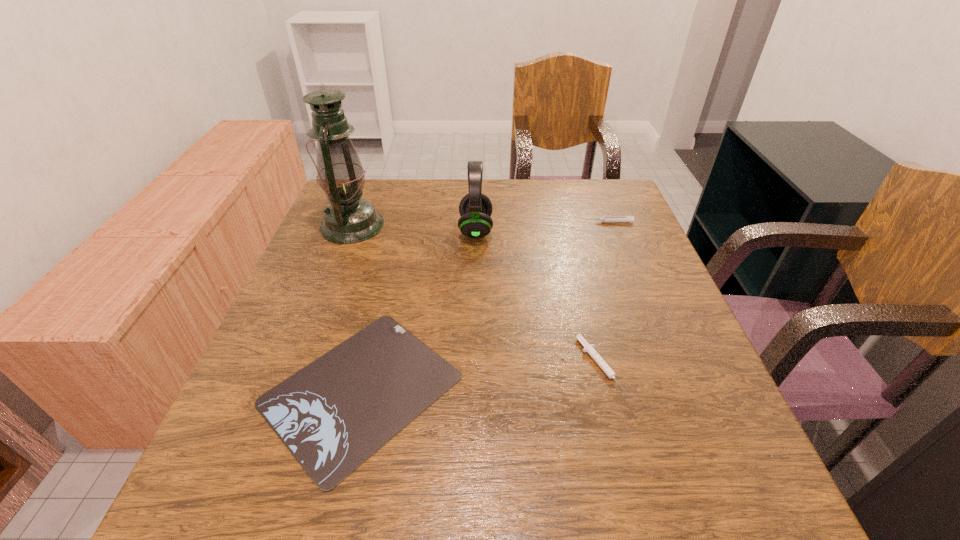
Identify which object is located as the fourth nearest to the shortest object. Please provide its 2D coordinates. Your answer should be formatted as a tuple, i.e. [(x, y)], where the tuple contains the x and y coordinates of a point satisfying the conditions above.

[(630, 219)]

The image size is (960, 540). What are the coordinates of `object that is the second closest to the oil lamp` in the screenshot? It's located at (333, 414).

This screenshot has width=960, height=540. I want to click on vacant point that satisfies the following two spatial constraints: 1. on the ear cups of the headset; 2. on the right side of the shorter syringe, so click(474, 365).

Where is `free space that satisfies the following two spatial constraints: 1. at the needle end of the farther syringe; 2. on the front side of the shortest object`? The width and height of the screenshot is (960, 540). free space that satisfies the following two spatial constraints: 1. at the needle end of the farther syringe; 2. on the front side of the shortest object is located at coordinates (675, 389).

Identify the location of vacant space that satisfies the following two spatial constraints: 1. on the ear cups of the fourth tallest object; 2. on the right side of the second tallest object. The image size is (960, 540). (474, 365).

You are a GUI agent. You are given a task and a screenshot of the screen. Output one action in this format:
    pyautogui.click(x=<x>, y=<y>)
    Task: Click on the blank area in the image that satisfies the following two spatial constraints: 1. at the needle end of the rightmost object; 2. on the front side of the tallest object
    Image resolution: width=960 pixels, height=540 pixels.
    Given the screenshot: What is the action you would take?
    pyautogui.click(x=611, y=225)